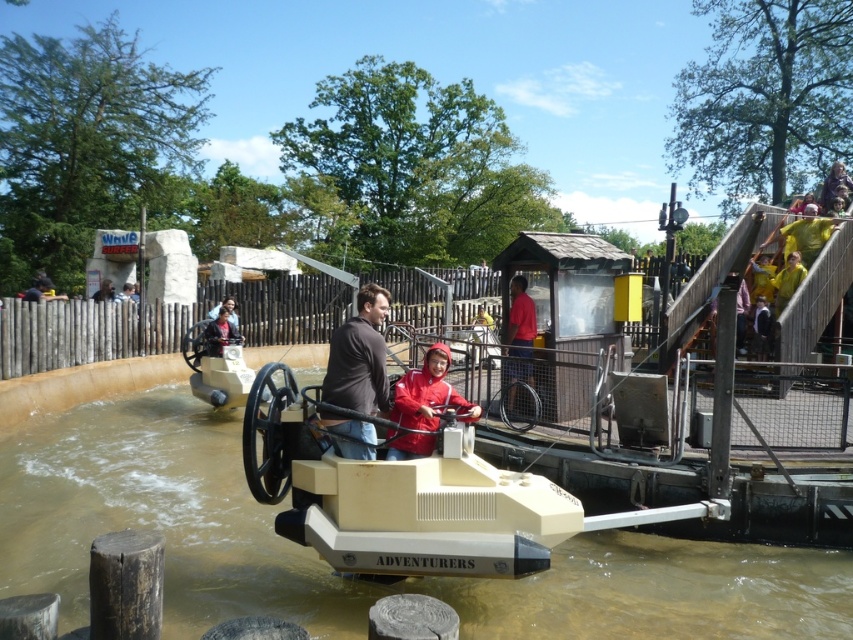
Question: Can you confirm if brown leather jacket at center is positioned to the left of red matte jacket at center?

Choices:
 (A) no
 (B) yes

Answer: (B)

Question: Which of the following is the farthest from the observer?

Choices:
 (A) matte red shirt at center
 (B) brown leather jacket at center
 (C) red matte jacket at center

Answer: (A)

Question: Does matte red shirt at center appear on the right side of light brown leather jacket at center?

Choices:
 (A) no
 (B) yes

Answer: (B)

Question: Is matte red shirt at center bigger than light brown leather jacket at center?

Choices:
 (A) yes
 (B) no

Answer: (B)

Question: Which point is farther to the camera?

Choices:
 (A) (216, 330)
 (B) (462, 400)
 (C) (511, 368)
 (D) (352, 452)

Answer: (A)

Question: Which is nearer to the brown leather jacket at center?

Choices:
 (A) matte red shirt at center
 (B) red matte jacket at center
 (C) light brown leather jacket at center

Answer: (B)